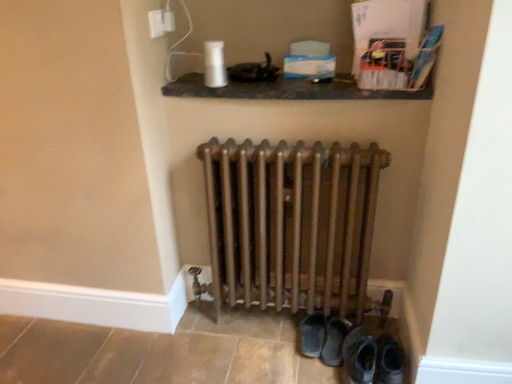
Question: Is white plastic electric outlet at upper center directly adjacent to matte black shelf at upper center?

Choices:
 (A) yes
 (B) no

Answer: (B)

Question: Can you confirm if white plastic electric outlet at upper center is positioned to the left of matte black shelf at upper center?

Choices:
 (A) yes
 (B) no

Answer: (A)

Question: Can you confirm if white plastic electric outlet at upper center is wider than matte black shelf at upper center?

Choices:
 (A) no
 (B) yes

Answer: (A)

Question: Does white plastic electric outlet at upper center have a larger size compared to matte black shelf at upper center?

Choices:
 (A) yes
 (B) no

Answer: (B)

Question: From the image's perspective, is white plastic electric outlet at upper center under matte black shelf at upper center?

Choices:
 (A) yes
 (B) no

Answer: (B)

Question: Is white plastic electric outlet at upper center oriented away from matte black shelf at upper center?

Choices:
 (A) no
 (B) yes

Answer: (A)

Question: Can you confirm if white plastic electric outlet at upper center is taller than leather boot at lower right, which appears as the 2th footwear when viewed from the left?

Choices:
 (A) yes
 (B) no

Answer: (B)

Question: Can you confirm if white plastic electric outlet at upper center is positioned to the right of leather boot at lower right, which appears as the 2th footwear when viewed from the left?

Choices:
 (A) yes
 (B) no

Answer: (B)

Question: From the image's perspective, is white plastic electric outlet at upper center located above leather boot at lower right, which appears as the 2th footwear when viewed from the left?

Choices:
 (A) no
 (B) yes

Answer: (B)

Question: Does white plastic electric outlet at upper center come in front of leather boot at lower right, which appears as the 2th footwear when viewed from the left?

Choices:
 (A) yes
 (B) no

Answer: (B)

Question: From a real-world perspective, is white plastic electric outlet at upper center positioned under leather boot at lower right, the 1th footwear when ordered from right to left, based on gravity?

Choices:
 (A) yes
 (B) no

Answer: (B)

Question: Can you confirm if white plastic electric outlet at upper center is smaller than leather boot at lower right, which appears as the 2th footwear when viewed from the left?

Choices:
 (A) yes
 (B) no

Answer: (A)

Question: Is dark brown leather shoes at lower center, positioned as the 2th footwear in right-to-left order, smaller than bronze metallic radiator at center?

Choices:
 (A) no
 (B) yes

Answer: (B)